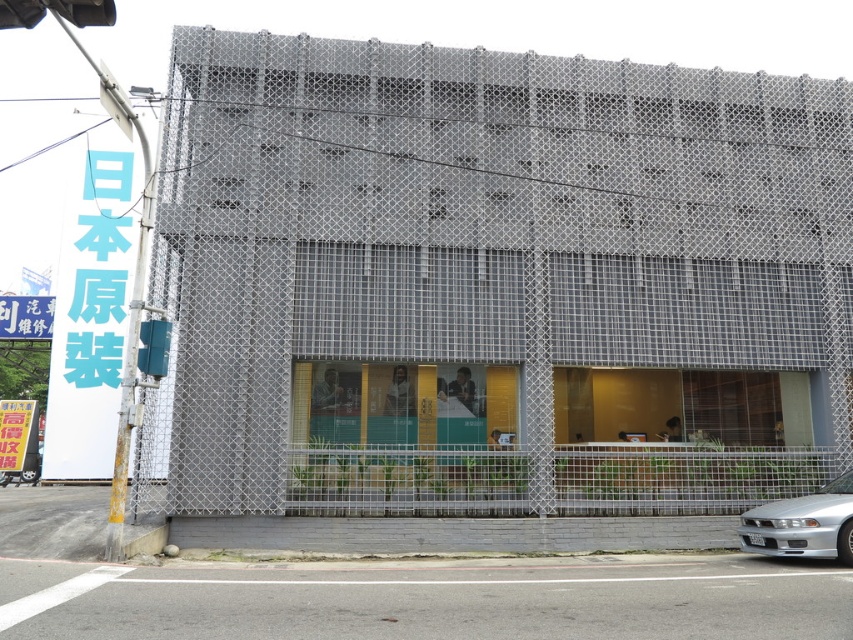
In the scene shown: Is matte gray building at center closer to the viewer compared to silver metallic car at lower right?

No, matte gray building at center is further to the viewer.

From the picture: Can you confirm if matte gray building at center is smaller than silver metallic car at lower right?

No, matte gray building at center is not smaller than silver metallic car at lower right.

Is point (706, 93) more distant than point (753, 518)?

Yes.

Find the location of `matte gray building at center`. matte gray building at center is located at coordinates (494, 284).